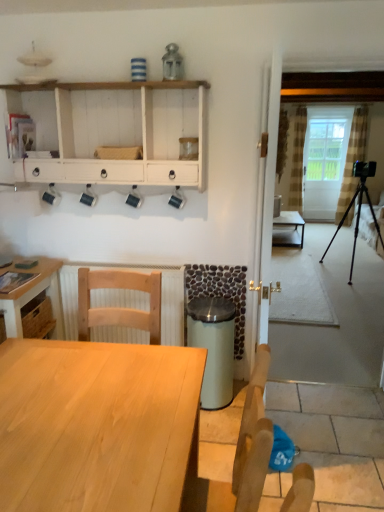
Question: Is light wood table at lower left, the 2th table when ordered from left to right, far away from light wood table at lower left, which is the 2th table from front to back?

Choices:
 (A) yes
 (B) no

Answer: (B)

Question: From a real-world perspective, does light wood table at lower left, which is the 3th table in back-to-front order, stand above light wood table at lower left, the second table positioned from the back?

Choices:
 (A) no
 (B) yes

Answer: (A)

Question: Considering the relative positions of light wood table at lower left, the 1th table positioned from the front, and light wood table at lower left, the second table when ordered from bottom to top, in the image provided, is light wood table at lower left, the 1th table positioned from the front, to the left of light wood table at lower left, the second table when ordered from bottom to top, from the viewer's perspective?

Choices:
 (A) no
 (B) yes

Answer: (A)

Question: Is light wood table at lower left, placed as the 1th table when sorted from bottom to top, at the right side of light wood table at lower left, the second table in the top-to-bottom sequence?

Choices:
 (A) yes
 (B) no

Answer: (A)

Question: Does light wood table at lower left, which ranks as the 3th table in top-to-bottom order, turn towards light wood table at lower left, the second table in the top-to-bottom sequence?

Choices:
 (A) no
 (B) yes

Answer: (A)

Question: Is light wood table at lower left, the 2th table when ordered from left to right, placed right next to light wood table at lower left, which is the 2th table from front to back?

Choices:
 (A) no
 (B) yes

Answer: (A)

Question: From the image's perspective, would you say black metal tripod at right is shown under white glass screen door at center?

Choices:
 (A) yes
 (B) no

Answer: (A)

Question: Can you confirm if black metal tripod at right is thinner than white glass screen door at center?

Choices:
 (A) yes
 (B) no

Answer: (B)

Question: Is black metal tripod at right aimed at white glass screen door at center?

Choices:
 (A) no
 (B) yes

Answer: (A)

Question: Does black metal tripod at right have a greater height compared to white glass screen door at center?

Choices:
 (A) yes
 (B) no

Answer: (B)

Question: Are black metal tripod at right and white glass screen door at center located far from each other?

Choices:
 (A) yes
 (B) no

Answer: (B)

Question: Considering the relative positions of black metal tripod at right and white glass screen door at center in the image provided, is black metal tripod at right to the left of white glass screen door at center from the viewer's perspective?

Choices:
 (A) yes
 (B) no

Answer: (A)

Question: Would you say light wood chair at lower left is outside white glass screen door at center?

Choices:
 (A) no
 (B) yes

Answer: (B)